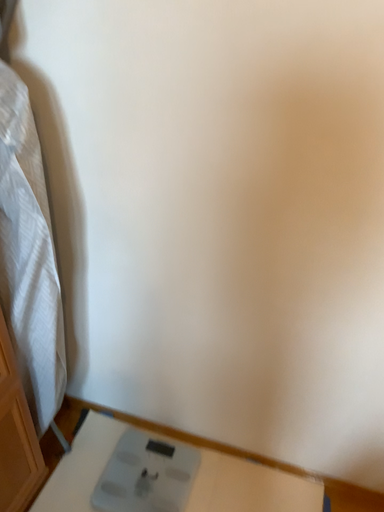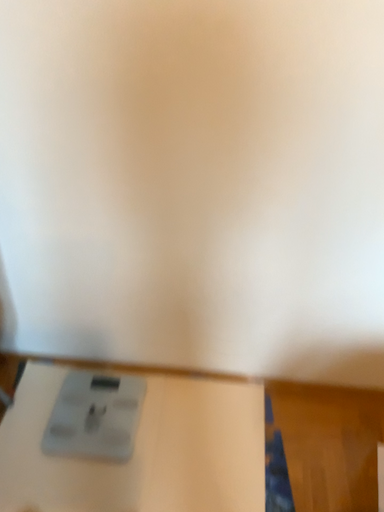
Question: How did the camera likely rotate when shooting the video?

Choices:
 (A) rotated right
 (B) rotated left

Answer: (A)